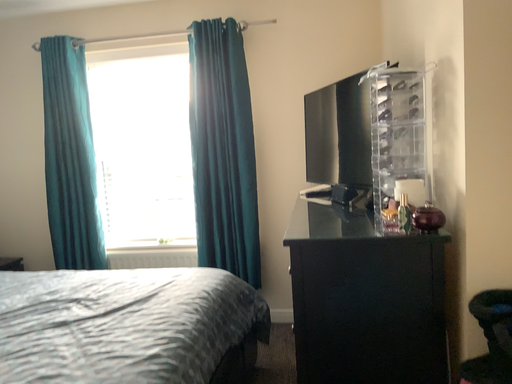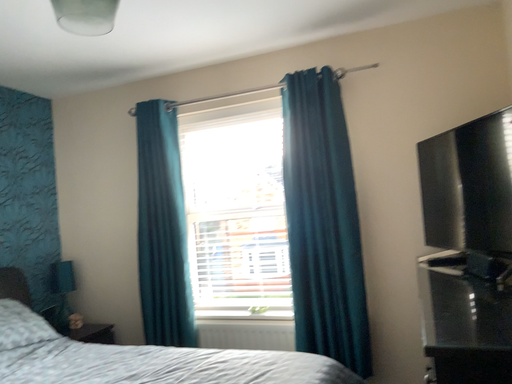
Question: Which way did the camera rotate in the video?

Choices:
 (A) rotated left
 (B) rotated right

Answer: (A)